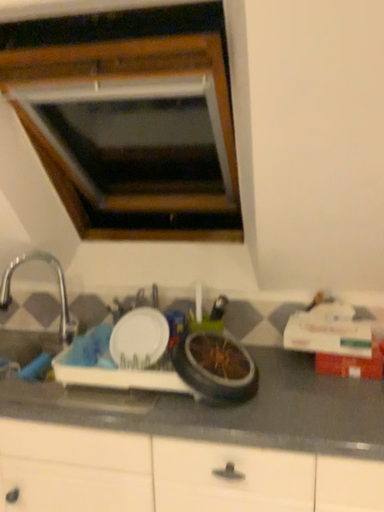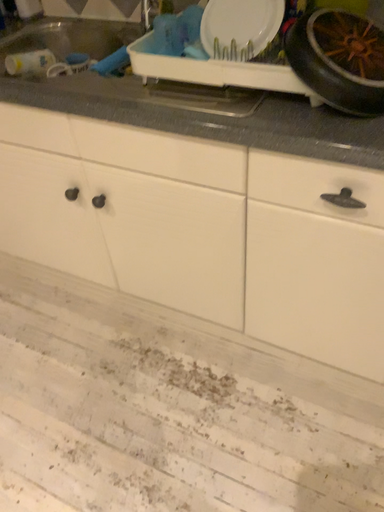
Question: Which way did the camera rotate in the video?

Choices:
 (A) rotated downward
 (B) rotated upward

Answer: (A)